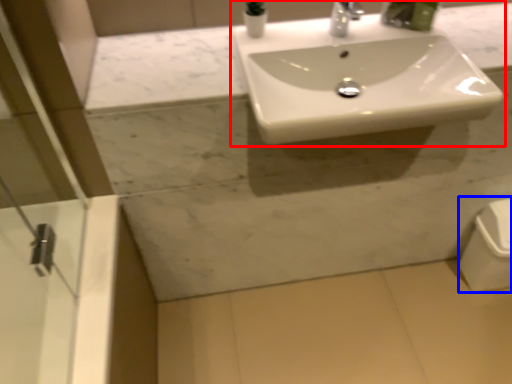
Question: Which object is closer to the camera taking this photo, sink (highlighted by a red box) or porcelain (highlighted by a blue box)?

Choices:
 (A) sink
 (B) porcelain

Answer: (A)